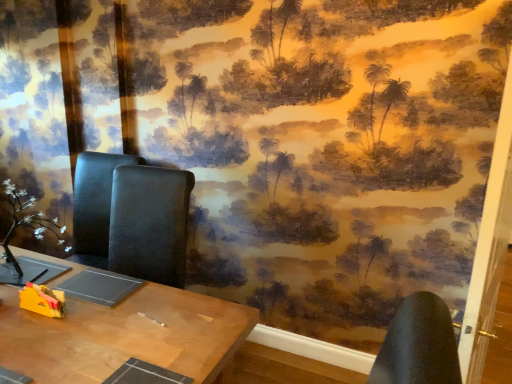
Question: Is wooden table at center far from white matte flower at left?

Choices:
 (A) yes
 (B) no

Answer: (B)

Question: From a real-world perspective, is wooden table at center beneath white matte flower at left?

Choices:
 (A) yes
 (B) no

Answer: (A)

Question: Does wooden table at center come behind white matte flower at left?

Choices:
 (A) yes
 (B) no

Answer: (B)

Question: Would you say wooden table at center is outside white matte flower at left?

Choices:
 (A) yes
 (B) no

Answer: (A)

Question: From a real-world perspective, is wooden table at center physically above white matte flower at left?

Choices:
 (A) no
 (B) yes

Answer: (A)

Question: Would you say wooden table at center contains white matte flower at left?

Choices:
 (A) yes
 (B) no

Answer: (B)

Question: From a real-world perspective, is yellow plastic toy at lower left positioned under wooden table at center based on gravity?

Choices:
 (A) no
 (B) yes

Answer: (A)

Question: From the image's perspective, is yellow plastic toy at lower left located above wooden table at center?

Choices:
 (A) yes
 (B) no

Answer: (A)

Question: Does yellow plastic toy at lower left have a greater width compared to wooden table at center?

Choices:
 (A) yes
 (B) no

Answer: (B)

Question: From the image's perspective, does yellow plastic toy at lower left appear lower than wooden table at center?

Choices:
 (A) no
 (B) yes

Answer: (A)

Question: Is there a large distance between yellow plastic toy at lower left and wooden table at center?

Choices:
 (A) no
 (B) yes

Answer: (A)

Question: Is yellow plastic toy at lower left shorter than wooden table at center?

Choices:
 (A) yes
 (B) no

Answer: (A)

Question: Is white matte flower at left positioned in front of wooden table at center?

Choices:
 (A) no
 (B) yes

Answer: (A)